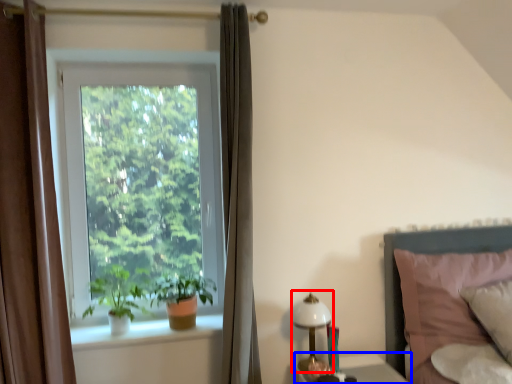
Question: Which point is further to the camera, bedside lamp (highlighted by a red box) or table (highlighted by a blue box)?

Choices:
 (A) bedside lamp
 (B) table

Answer: (A)